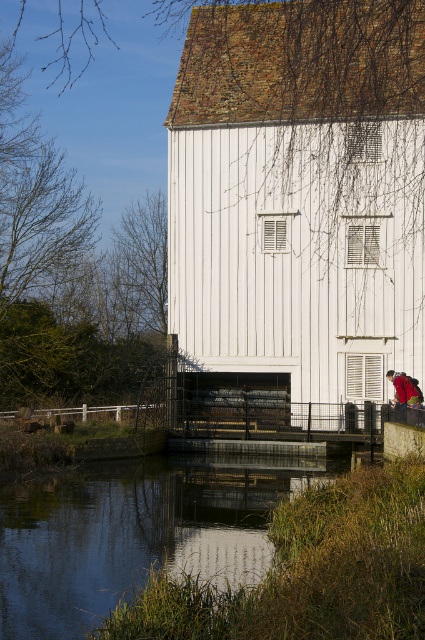
Question: Which point is farther from the camera taking this photo?

Choices:
 (A) (419, 401)
 (B) (65, 525)

Answer: (A)

Question: Is smooth reflective water at lower center smaller than red fabric backpack at lower right?

Choices:
 (A) yes
 (B) no

Answer: (B)

Question: Which object appears closest to the camera in this image?

Choices:
 (A) smooth reflective water at lower center
 (B) red fabric backpack at lower right

Answer: (A)

Question: Can you confirm if smooth reflective water at lower center is positioned to the left of red fabric backpack at lower right?

Choices:
 (A) yes
 (B) no

Answer: (A)

Question: Can you confirm if smooth reflective water at lower center is bigger than red fabric backpack at lower right?

Choices:
 (A) no
 (B) yes

Answer: (B)